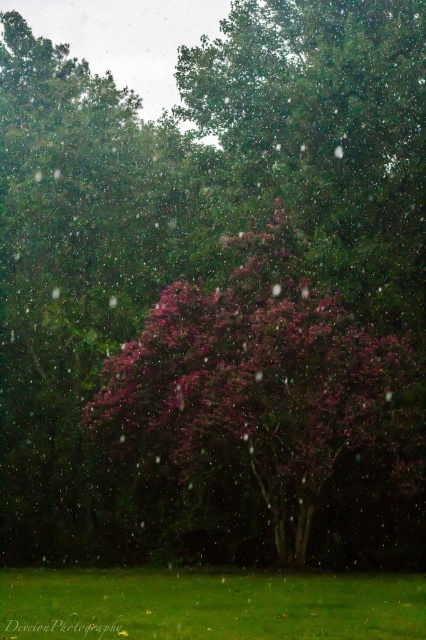
How distant is pink matte flower at center from green grass at lower center?

A distance of 10.74 feet exists between pink matte flower at center and green grass at lower center.

Who is lower down, pink matte flower at center or green grass at lower center?

green grass at lower center is below.

Which is behind, point (340, 419) or point (63, 580)?

Positioned behind is point (63, 580).

Where is `pink matte flower at center`? This screenshot has width=426, height=640. pink matte flower at center is located at coordinates (261, 381).